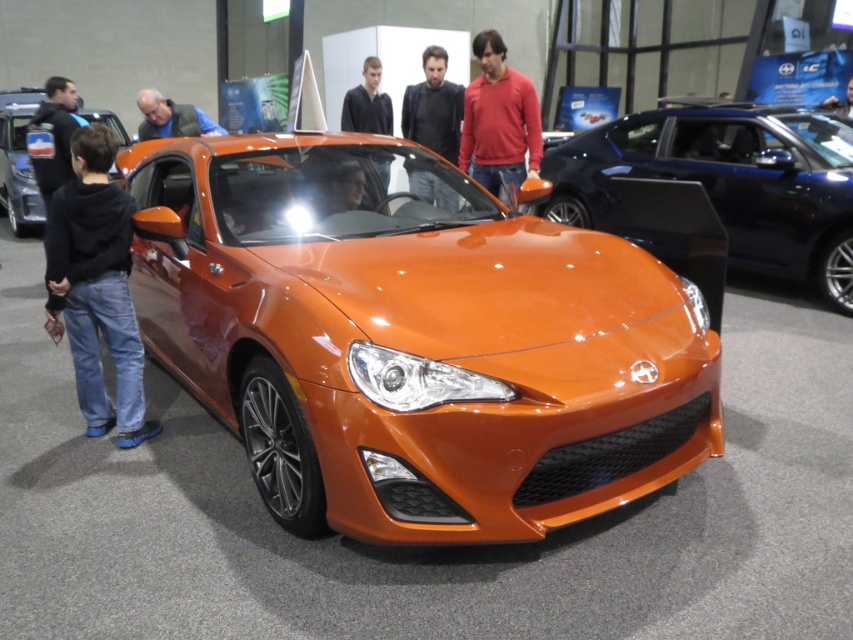
Can you confirm if shiny orange car at center is positioned above dark brown leather jacket at center?

No.

Is point (793, 125) closer to viewer compared to point (445, 60)?

Yes, point (793, 125) is in front of point (445, 60).

This screenshot has width=853, height=640. I want to click on shiny orange car at center, so click(x=728, y=180).

Is shiny orange sports car at center wider than shiny orange car at center?

Indeed, shiny orange sports car at center has a greater width compared to shiny orange car at center.

Does shiny orange sports car at center appear over shiny orange car at center?

No, shiny orange sports car at center is not above shiny orange car at center.

Locate an element on the screen. shiny orange sports car at center is located at coordinates (415, 340).

This screenshot has width=853, height=640. In order to click on shiny orange sports car at center in this screenshot , I will do (x=415, y=340).

Who is more distant from viewer, (444, 182) or (51, 93)?

Point (51, 93)

Can you confirm if shiny orange sports car at center is positioned below matte black jacket at left?

Yes.

Between point (328, 438) and point (44, 189), which one is positioned in front?

Point (328, 438) is more forward.

At what (x,y) coordinates should I click in order to perform the action: click on shiny orange sports car at center. Please return your answer as a coordinate pair (x, y). Looking at the image, I should click on (415, 340).